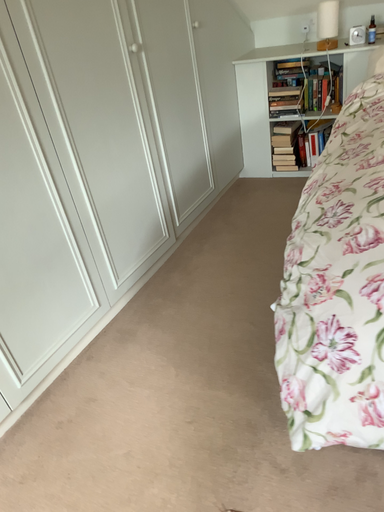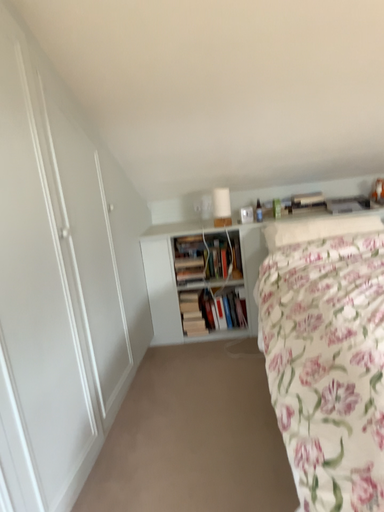
Question: Which way did the camera rotate in the video?

Choices:
 (A) rotated right
 (B) rotated left

Answer: (A)